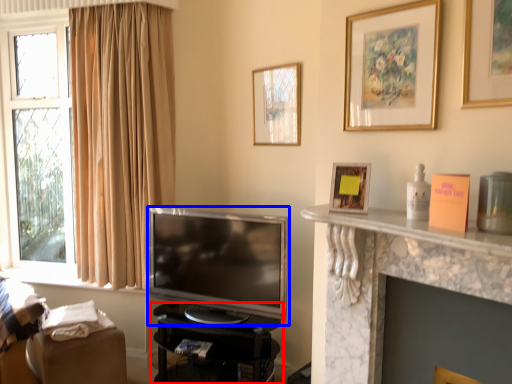
Question: Among these objects, which one is nearest to the camera, furniture (highlighted by a red box) or television (highlighted by a blue box)?

Choices:
 (A) furniture
 (B) television

Answer: (B)